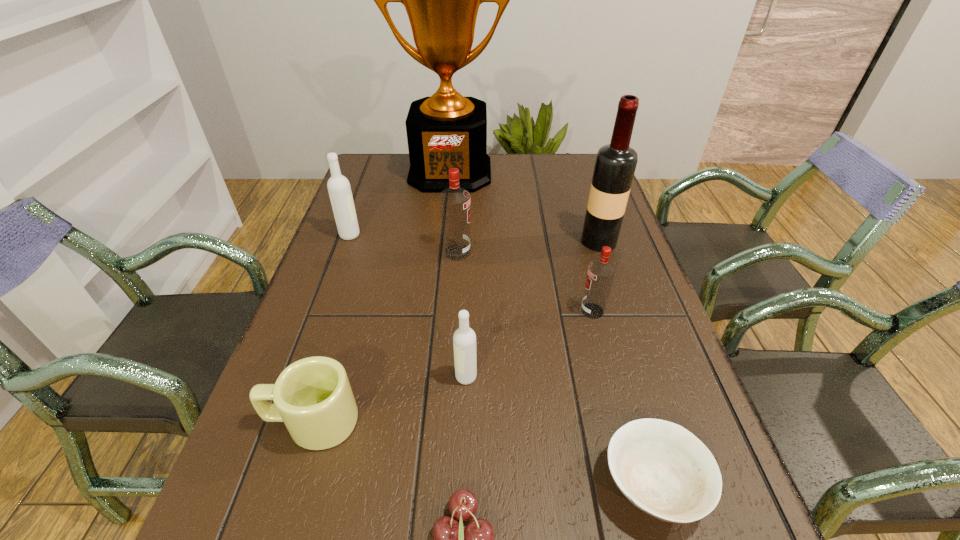
What are the coordinates of `trophy cup` in the screenshot? It's located at click(446, 130).

Image resolution: width=960 pixels, height=540 pixels. I want to click on gold trophy cup, so click(x=446, y=130).

Locate an element on the screen. The width and height of the screenshot is (960, 540). the second tallest object is located at coordinates (615, 164).

The height and width of the screenshot is (540, 960). Identify the location of the leftmost vodka. (339, 189).

Image resolution: width=960 pixels, height=540 pixels. Identify the location of the farthest vodka. (339, 189).

The height and width of the screenshot is (540, 960). What are the coordinates of `the farther red vodka` in the screenshot? It's located at (455, 202).

Image resolution: width=960 pixels, height=540 pixels. Identify the location of the bigger red vodka. (455, 202).

You are a GUI agent. You are given a task and a screenshot of the screen. Output one action in this format:
    pyautogui.click(x=<x>, y=<y>)
    Task: Click on the smaller red vodka
    The height and width of the screenshot is (540, 960).
    Given the screenshot: What is the action you would take?
    pyautogui.click(x=601, y=272)

This screenshot has width=960, height=540. In order to click on the rightmost vodka in this screenshot , I will do `click(601, 272)`.

Identify the location of the sixth farthest object. (464, 339).